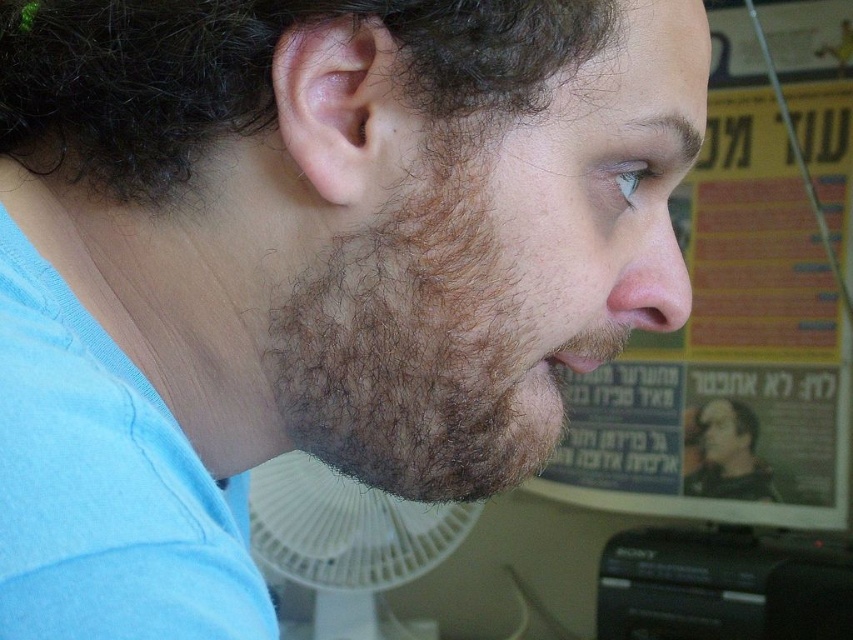
Does yellow paper at upper right appear on the left side of white plastic fan at lower center?

In fact, yellow paper at upper right is to the right of white plastic fan at lower center.

What do you see at coordinates (740, 304) in the screenshot? I see `yellow paper at upper right` at bounding box center [740, 304].

Is point (790, 360) positioned after point (300, 538)?

Yes.

Locate an element on the screen. yellow paper at upper right is located at coordinates (740, 304).

Is white plastic fan at lower center wider than pink flesh-colored ear at center?

Indeed, white plastic fan at lower center has a greater width compared to pink flesh-colored ear at center.

Which is behind, point (276, 488) or point (280, 102)?

Point (276, 488)

Find the location of a particular element. This screenshot has width=853, height=640. white plastic fan at lower center is located at coordinates (345, 540).

Who is positioned more to the left, brown fuzzy beard at lower left or white plastic fan at lower center?

white plastic fan at lower center

Is brown fuzzy beard at lower left below white plastic fan at lower center?

Incorrect, brown fuzzy beard at lower left is not positioned below white plastic fan at lower center.

Locate an element on the screen. This screenshot has width=853, height=640. brown fuzzy beard at lower left is located at coordinates (415, 346).